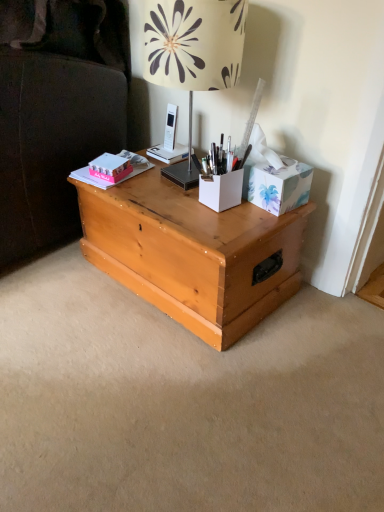
This screenshot has height=512, width=384. In order to click on vacant point to the left of light wood trunk at center in this screenshot , I will do `click(64, 294)`.